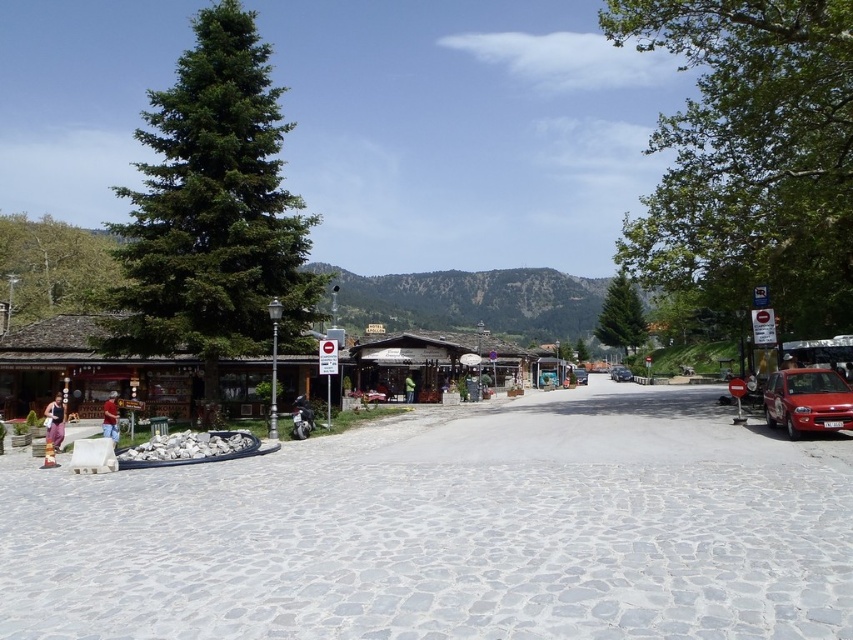
Who is shorter, denim pants at left or matte black jacket at left?

denim pants at left is shorter.

Is denim pants at left thinner than matte black jacket at left?

No, denim pants at left is not thinner than matte black jacket at left.

Does point (51, 401) come behind point (107, 426)?

Yes, point (51, 401) is behind point (107, 426).

Where is `denim pants at left`? denim pants at left is located at coordinates click(55, 420).

Who is shorter, matte black jacket at left or shiny red car at center?

Standing shorter between the two is shiny red car at center.

Consider the image. Is matte black jacket at left to the right of shiny red car at center from the viewer's perspective?

In fact, matte black jacket at left is to the left of shiny red car at center.

Locate an element on the screen. matte black jacket at left is located at coordinates (109, 419).

Does green glossy pine at left appear on the right side of shiny red car at right?

In fact, green glossy pine at left is to the left of shiny red car at right.

Can you confirm if green glossy pine at left is taller than shiny red car at right?

Indeed, green glossy pine at left has a greater height compared to shiny red car at right.

The image size is (853, 640). I want to click on green glossy pine at left, so click(213, 212).